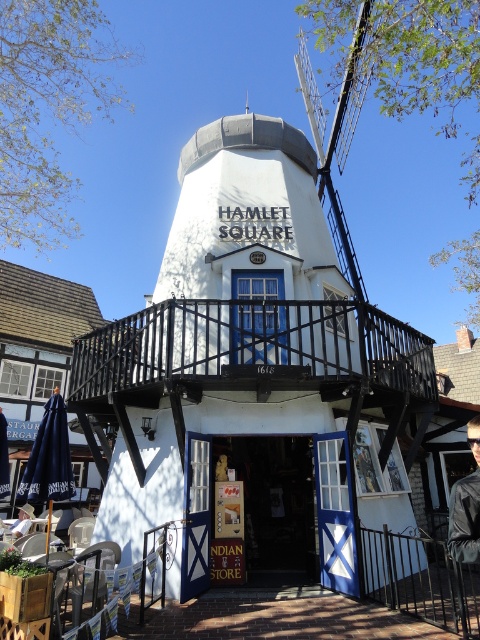
You are a visitor in the town square and want to take a photo of the white painted wood windmill at center and the black metal railing at lower right. If you want both objects to appear in the same frame, which one should you focus on to ensure both are visible?

Since the white painted wood windmill at center is larger than the black metal railing at lower right, you should focus on the white painted wood windmill at center to ensure both are visible in the frame.

You are standing in the town square and want to take a photo of the white painted wood windmill at center and the black metal railing at lower right. Which object should you focus on first if you want to capture both in the frame without moving the camera?

The white painted wood windmill at center is taller than the black metal railing at lower right, so focus on the white painted wood windmill at center first to ensure both are in frame.